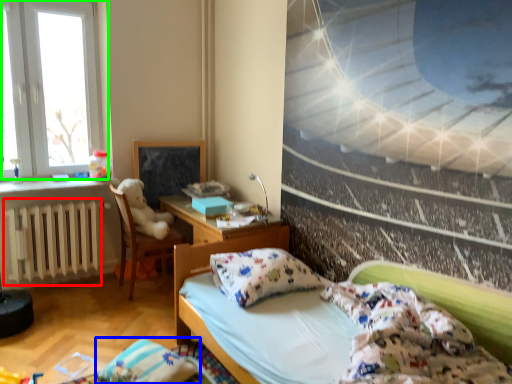
Question: Which is farther away from radiator (highlighted by a red box)? pillow (highlighted by a blue box) or window (highlighted by a green box)?

Choices:
 (A) pillow
 (B) window

Answer: (A)